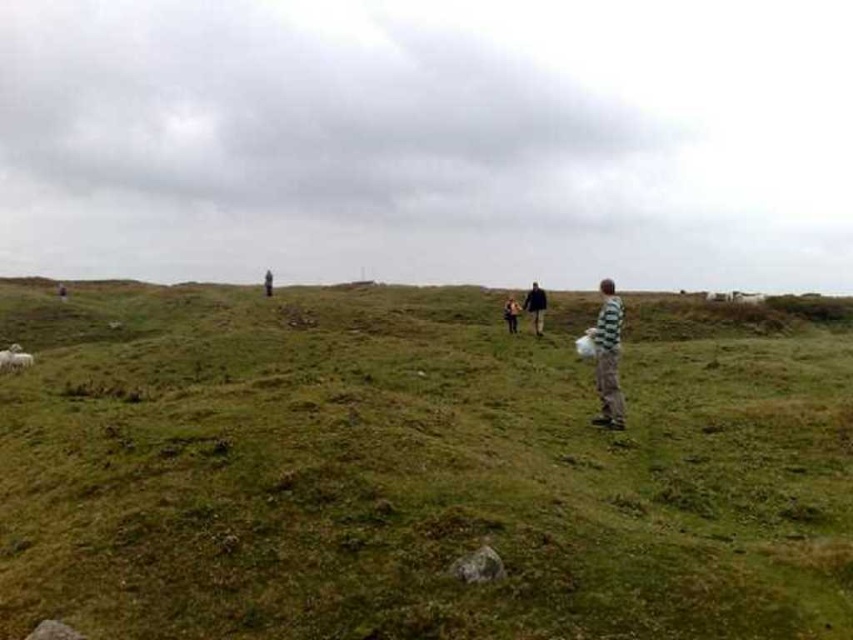
You are standing at the origin point of the coordinate system in the image. You want to walk towards the green grassy field at center. What direction should you head?

The green grassy field at center is located at coordinate point [416,467], so you should head towards the northeast direction.